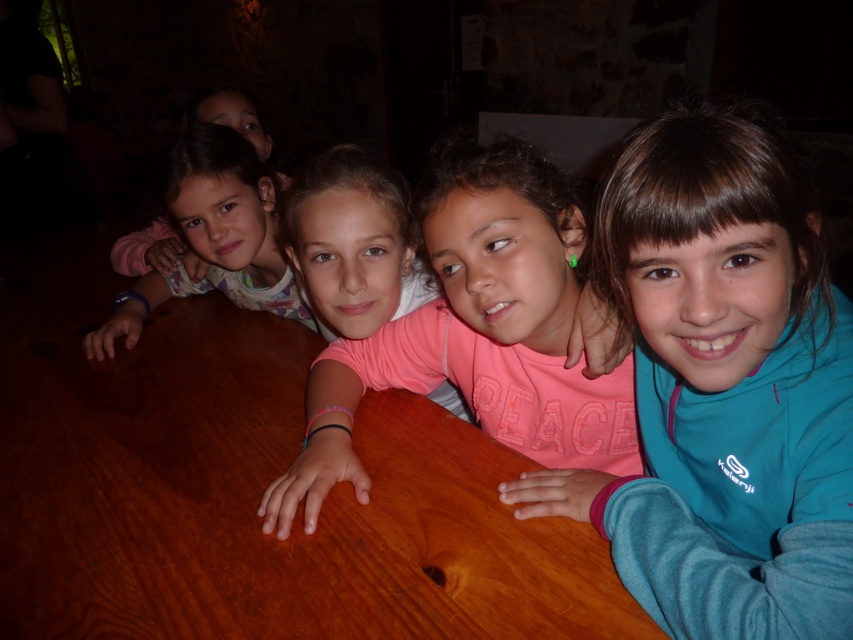
Question: Where is teal fleece jacket at center located in relation to matte pink shirt at upper left in the image?

Choices:
 (A) right
 (B) left

Answer: (A)

Question: Estimate the real-world distances between objects in this image. Which object is farther from the matte pink shirt at left?

Choices:
 (A) wooden table at center
 (B) matte pink shirt at upper left
 (C) teal fleece jacket at center
 (D) pink fabric shirt at center

Answer: (C)

Question: Is wooden table at center smaller than matte pink shirt at left?

Choices:
 (A) no
 (B) yes

Answer: (A)

Question: Which object is positioned farthest from the wooden table at center?

Choices:
 (A) pink fabric shirt at center
 (B) teal fleece jacket at center
 (C) matte pink shirt at left
 (D) matte pink shirt at upper left

Answer: (D)

Question: Is teal fleece jacket at center wider than matte pink shirt at left?

Choices:
 (A) yes
 (B) no

Answer: (B)

Question: Considering the real-world distances, which object is farthest from the teal fleece jacket at center?

Choices:
 (A) matte pink shirt at upper left
 (B) pink fabric shirt at center
 (C) wooden table at center

Answer: (A)